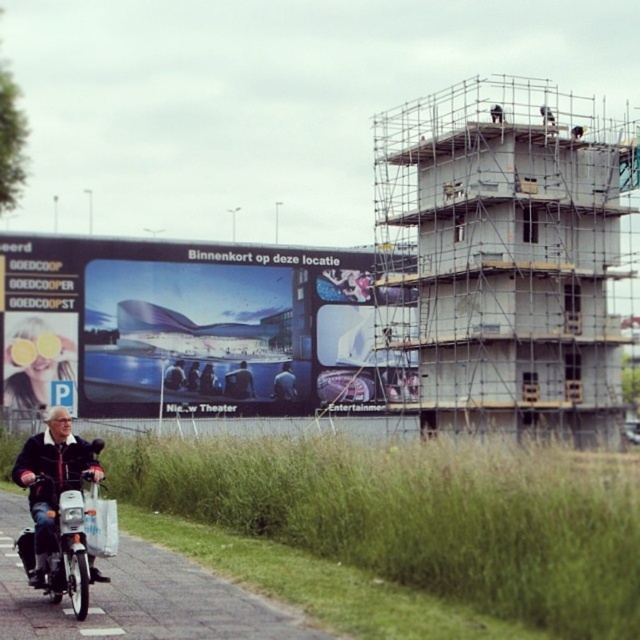
Question: Based on their relative distances, which object is nearer to the matte black jacket at lower left?

Choices:
 (A) matte black jacket at center
 (B) denim jacket at center
 (C) blue fabric jacket at center
 (D) dark blue jacket at center

Answer: (A)

Question: Among these objects, which one is farthest from the camera?

Choices:
 (A) matte glass billboard at center
 (B) dark blue jacket at center

Answer: (B)

Question: Can you confirm if matte yellow sunglasses at left is positioned above matte black jacket at lower left?

Choices:
 (A) yes
 (B) no

Answer: (A)

Question: Can you confirm if matte black jacket at lower left is positioned to the left of blue fabric jacket at center?

Choices:
 (A) no
 (B) yes

Answer: (B)

Question: Considering the relative positions of matte yellow sunglasses at left and matte black jacket at center in the image provided, where is matte yellow sunglasses at left located with respect to matte black jacket at center?

Choices:
 (A) below
 (B) above

Answer: (B)

Question: Which point appears farthest from the camera in this image?

Choices:
 (A) (179, 387)
 (B) (192, 376)
 (C) (248, 376)
 (D) (84, 444)

Answer: (C)